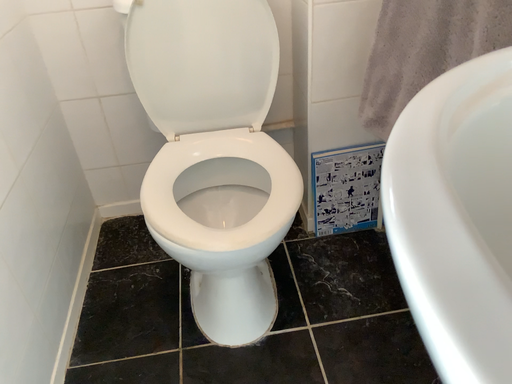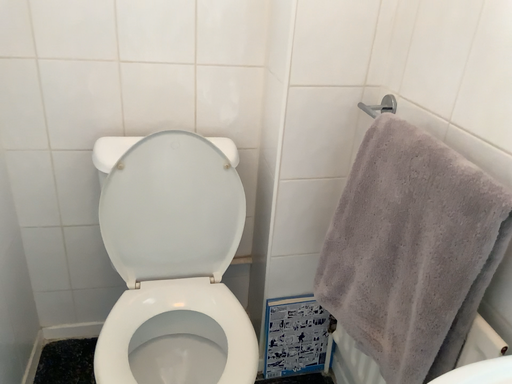
Question: How did the camera likely rotate when shooting the video?

Choices:
 (A) rotated downward
 (B) rotated upward

Answer: (B)